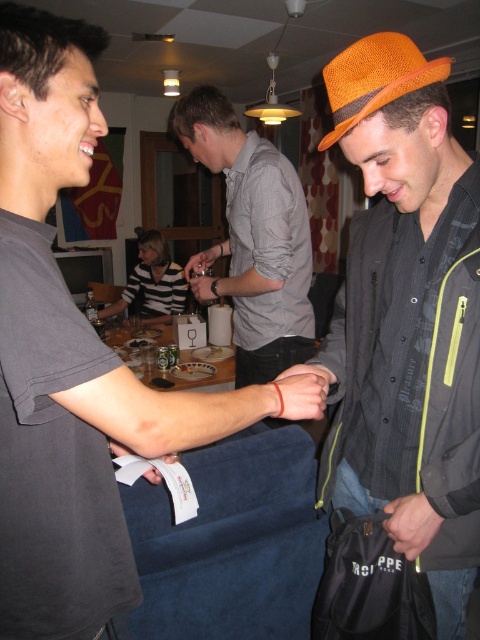
You are at a party and want to choose a hat to wear. You see an orange woven hat at right and an orange straw hat at upper right. Which one is bigger?

The orange woven hat at right is larger in size than the orange straw hat at upper right.

You are at the point marked as point (74, 362) in the image. What object is exactly at this point?

The matte black shirt at upper left is exactly at point (74, 362).

You are a photographer trying to capture a group photo of the matte black shirt at upper left and the orange straw hat at upper right. If you want to ensure both subjects are fully visible in the frame, which subject should you position closer to the camera to avoid cropping?

The matte black shirt at upper left should be positioned closer to the camera because its width is larger than the orange straw hat at upper right, ensuring both fit within the frame without cropping.